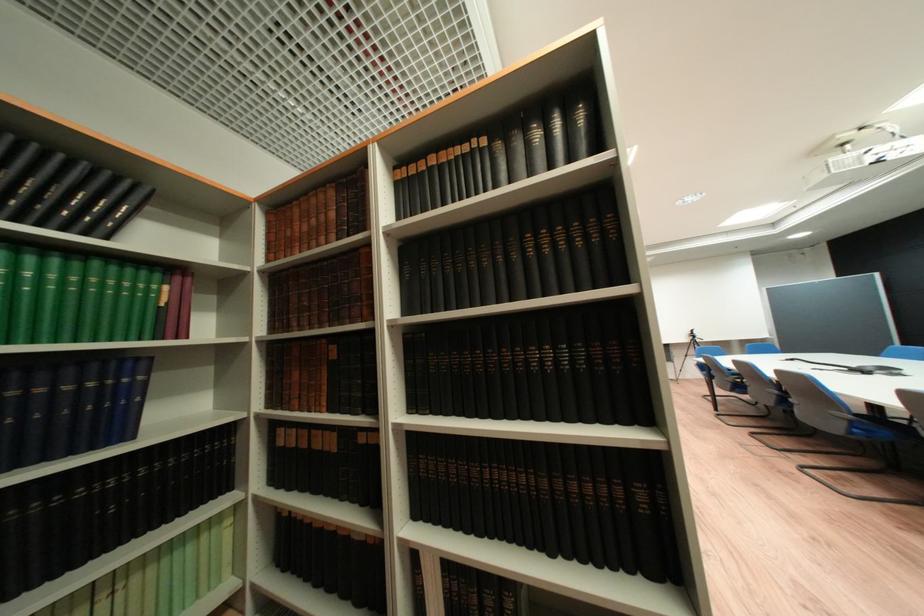
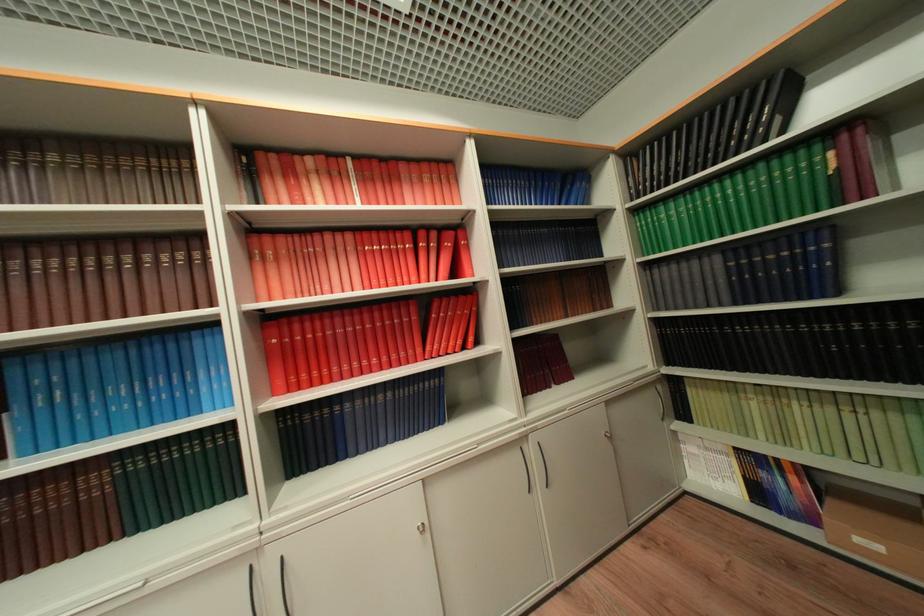
Locate, in the second image, the point that corresponds to point (188, 461) in the first image.

(914, 326)